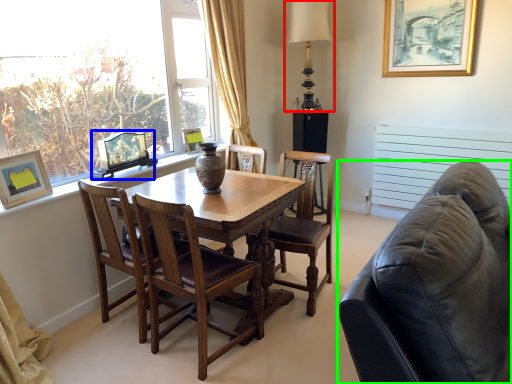
Question: Which is nearer to the table lamp (highlighted by a red box)? picture frame (highlighted by a blue box) or studio couch (highlighted by a green box).

Choices:
 (A) picture frame
 (B) studio couch

Answer: (A)